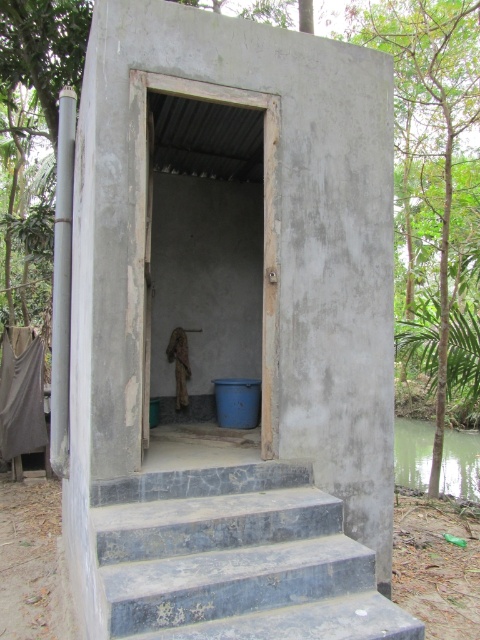
Question: Is smooth concrete hut at center positioned in front of dark gray concrete stairs at lower center?

Choices:
 (A) no
 (B) yes

Answer: (A)

Question: Is smooth concrete hut at center to the left of dark gray concrete stairs at lower center from the viewer's perspective?

Choices:
 (A) yes
 (B) no

Answer: (A)

Question: Is smooth concrete hut at center thinner than dark gray concrete stairs at lower center?

Choices:
 (A) no
 (B) yes

Answer: (A)

Question: Among these objects, which one is farthest from the camera?

Choices:
 (A) dark gray concrete stairs at lower center
 (B) smooth concrete hut at center

Answer: (B)

Question: Which object appears closest to the camera in this image?

Choices:
 (A) dark gray concrete stairs at lower center
 (B) smooth concrete hut at center

Answer: (A)